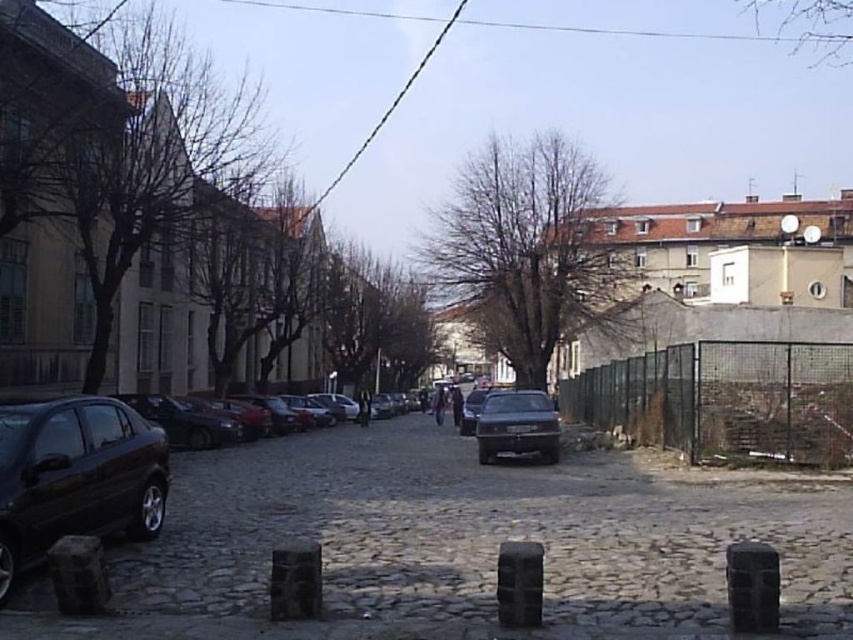
You are a delivery person trying to navigate through the dark gray cobblestone alley at center and the green wire mesh fence at right. Which path should you take to stay on the left side of the street?

You should take the dark gray cobblestone alley at center because it is positioned on the left side of the green wire mesh fence at right, which is on the right side of the street.

You are a delivery person trying to reach a package left at the green wire mesh fence at right. There is a matte black sedan at lower left in your way. Can you walk around the sedan to reach the fence?

The matte black sedan at lower left is behind the green wire mesh fence at right, so you can walk around the sedan to reach the fence.

You are a delivery person trying to navigate through the street. The dark gray cobblestone alley at center and the matte black sedan at lower left are in your path. Which object is closer to you as you approach the scene?

The dark gray cobblestone alley at center is closer to the viewer than the matte black sedan at lower left, so the alley is closer to you as you approach the scene.